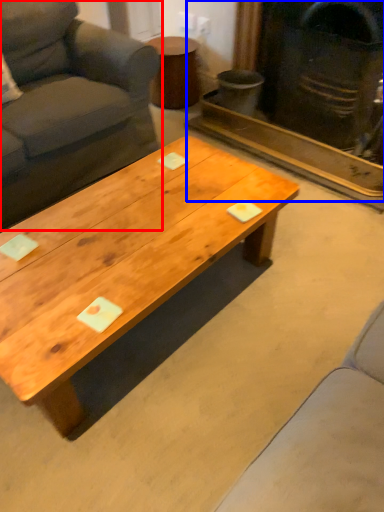
Question: Among these objects, which one is nearest to the camera, studio couch (highlighted by a red box) or fireplace (highlighted by a blue box)?

Choices:
 (A) studio couch
 (B) fireplace

Answer: (A)